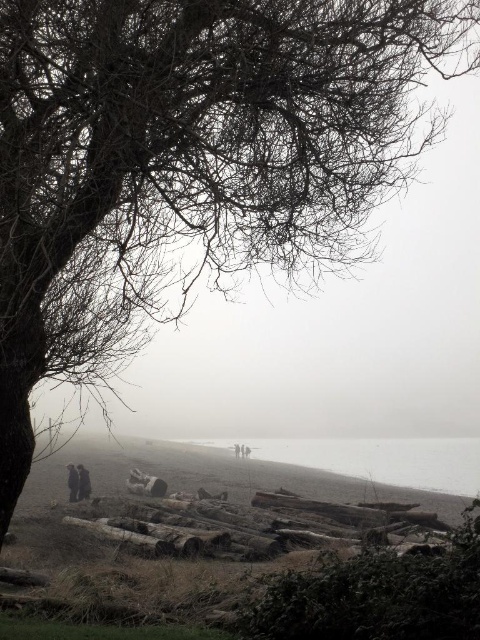
You are a hiker who has just arrived at the beach and sees the brown rough wood at lower center and the dark gray fabric jacket at lower left. You want to pick up the smaller item to use as a marker. Which item should you choose?

The brown rough wood at lower center is smaller in size compared to the dark gray fabric jacket at lower left, so you should pick up the brown rough wood at lower center as the marker.

You are standing at the edge of the foggy beach and notice the brown rough wood at lower center. Based on its position, can you determine if it is closer to you or farther away compared to the large leafless tree on the left?

The brown rough wood at lower center is located at point (x=263, y=525), which places it closer to the viewer than the large leafless tree on the left. Therefore, it is closer to you.

You are standing on the beach and want to walk to the large tree on the left. You need to step over or around the dark gray fabric jacket at center. Is the gray foggy water at lower center blocking your path?

The gray foggy water at lower center is in front of the dark gray fabric jacket at center, meaning it is closer to you. Since the water is in front of the jacket, it would block your path to the tree, so you would need to go around it or step over the jacket first.